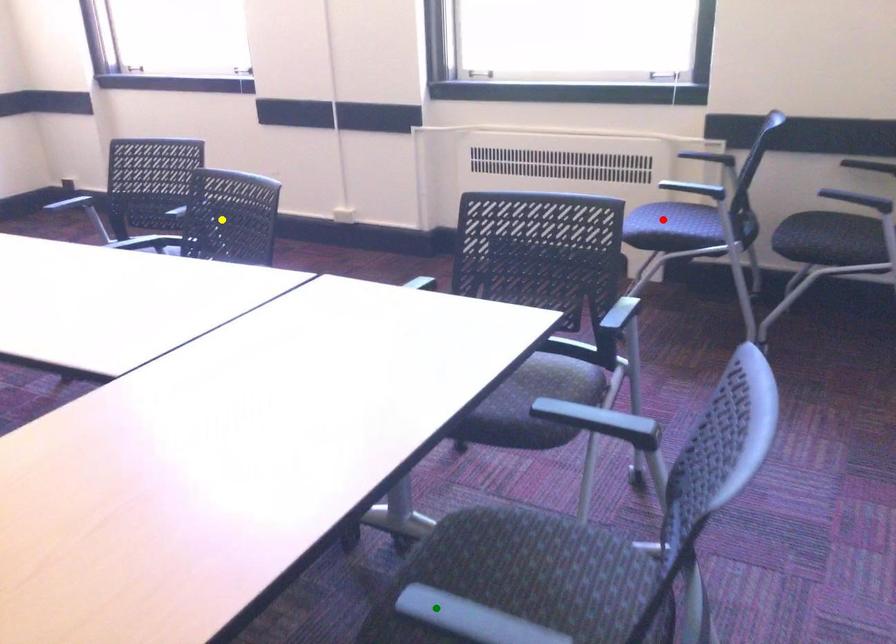
Order these from nearest to farthest:
yellow point, green point, red point

1. yellow point
2. red point
3. green point